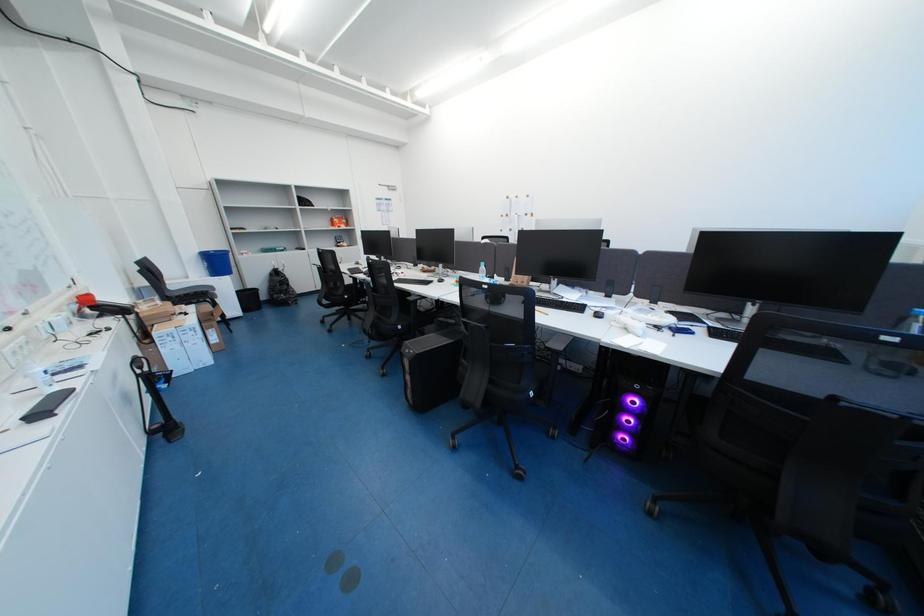
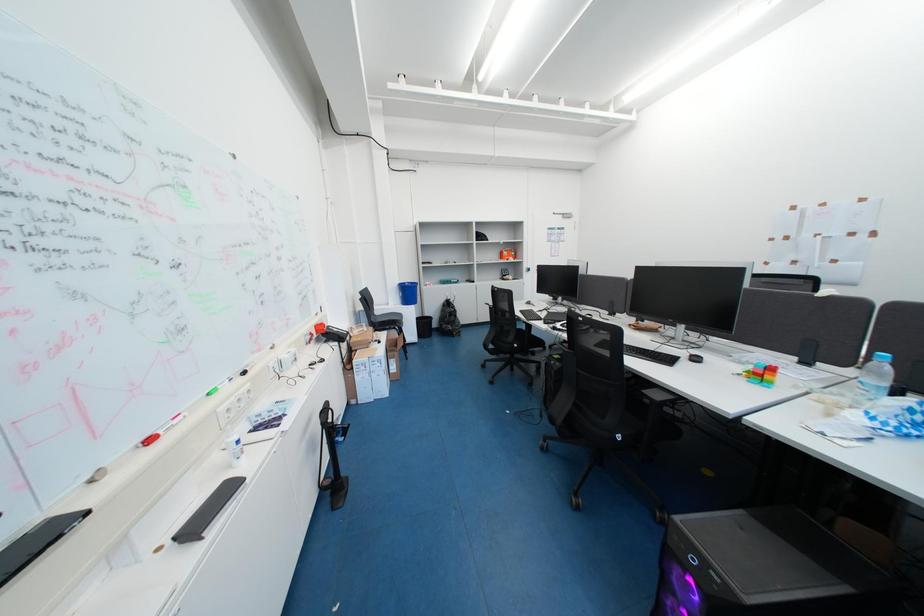
Question: The images are taken continuously from a first-person perspective. In which direction is your viewpoint rotating?

Choices:
 (A) Left
 (B) Right
 (C) Up
 (D) Down

Answer: (A)